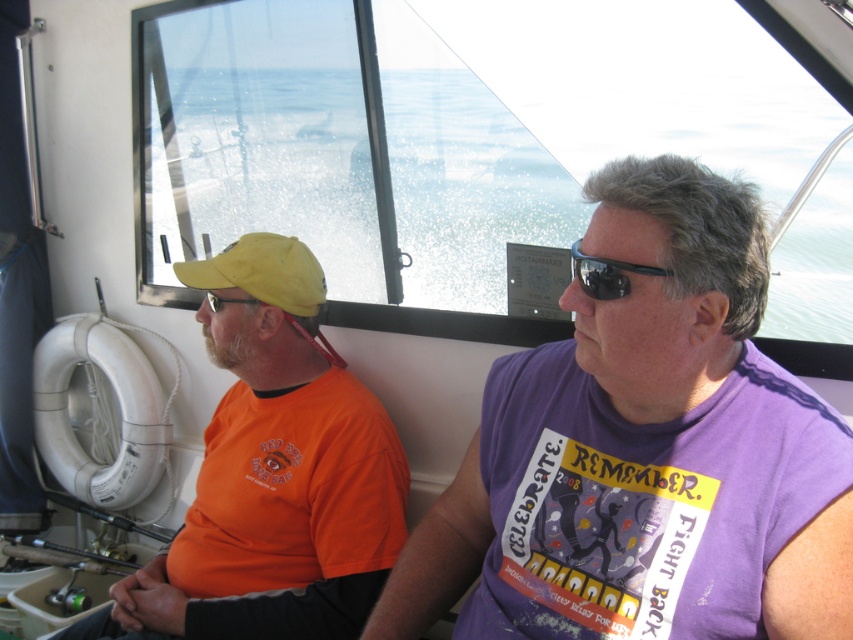
You are standing at the origin of a coordinate system placed at the bottom left corner of the image. You see a point at coordinates point (643,451). What object is located at that point?

The point (643,451) corresponds to the purple cotton shirt at center.

You are standing in the boat cabin and want to place a small item on the nearest point between point (735, 630) and point (618, 291). Which point should you choose?

Point (735, 630) is closer to the viewer than point (618, 291), so you should choose point (735, 630) to place the item.